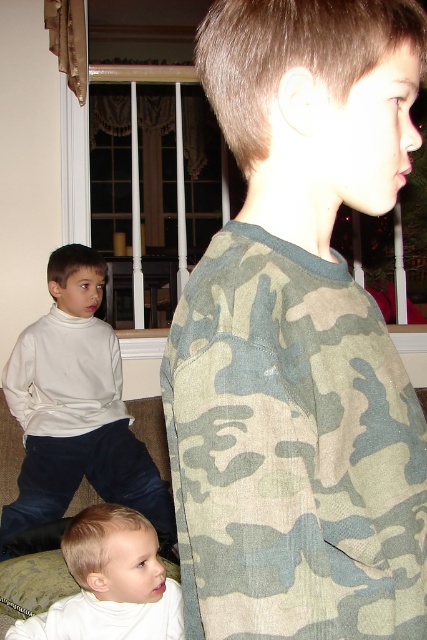
Can you confirm if camo fabric shirt at center is positioned below white soft baby at lower left?

No, camo fabric shirt at center is not below white soft baby at lower left.

Which of these two, camo fabric shirt at center or white soft baby at lower left, stands taller?

camo fabric shirt at center is taller.

Which is behind, point (263, 413) or point (145, 563)?

Point (145, 563)

Locate an element on the screen. The height and width of the screenshot is (640, 427). camo fabric shirt at center is located at coordinates (292, 451).

Can you confirm if camo fabric shirt at center is shorter than white turtleneck sweater at left?

Yes.

Between point (304, 371) and point (32, 525), which one is positioned behind?

Point (32, 525)

What are the coordinates of `camo fabric shirt at center` in the screenshot? It's located at (292, 451).

Is white turtleneck sweater at left closer to camera compared to white soft baby at lower left?

No.

Is point (22, 404) farther from camera compared to point (119, 564)?

Yes.

I want to click on white turtleneck sweater at left, so click(x=75, y=406).

Find the location of a particular element. The height and width of the screenshot is (640, 427). white turtleneck sweater at left is located at coordinates (75, 406).